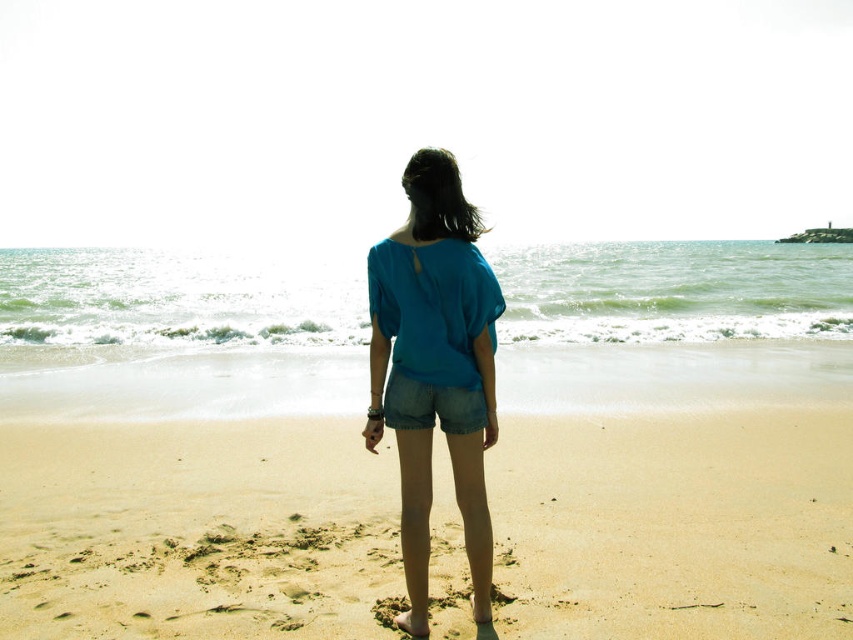
You are a photographer capturing the scene of a person on the beach. You notice the matte blue blouse at center and the denim shorts at center. Which clothing item appears larger in the photo?

The matte blue blouse at center appears larger than the denim shorts at center in the photo.

You are a photographer trying to capture the scene of a person on the beach. You want to ensure that both the smooth sand beach at center and the denim shorts at center are clearly visible in your photo. Based on their positions, which object should appear lower in the image?

The smooth sand beach at center appears lower in the image because it is positioned below the denim shorts at center.

You are standing on the smooth sand beach at center and want to place your denim shorts at center on the sand. Can you determine if the beach is wide enough to accommodate the shorts?

The smooth sand beach at center might be wider than denim shorts at center, so there is a possibility that the beach is wide enough to place the denim shorts at center on the sand.